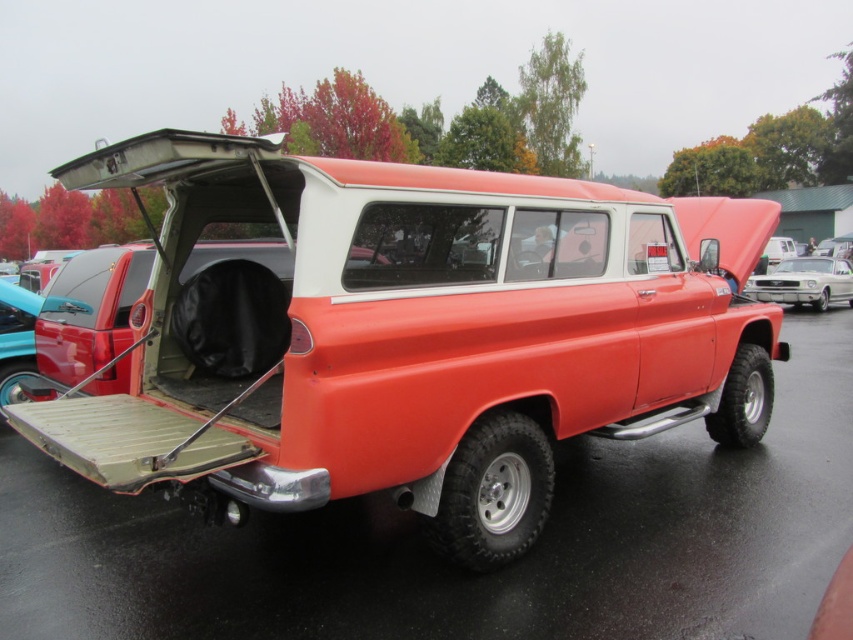
You are standing in front of the classic orange SUV with a white roof. There are two points marked on the vehicle. One is at coordinate point (94,403) and the other is at point (785,275). Which point is closer to you?

Point (94,403) is closer to the viewer than point (785,275).

You are a delivery person who needs to park your delivery van between the matte orange truck at center and the metallic silver car at right. Based on the scene, can you fit your van, which is 2 meters wide, in the available space between them?

The matte orange truck at center is narrower than the metallic silver car at right, but the exact width between them isn not provided. However, since the truck is narrower than the car, the space between them might be sufficient for your 2 meter wide van. Check the actual distance before proceeding.

You are a delivery person trying to load a tall package into your vehicle. You have two options in the scene, the matte orange truck at center and the metallic silver car at right. Which vehicle would allow you to load the package without tilting it, based on their heights?

The matte orange truck at center is taller than the metallic silver car at right, so the matte orange truck at center would allow you to load the package without tilting it.